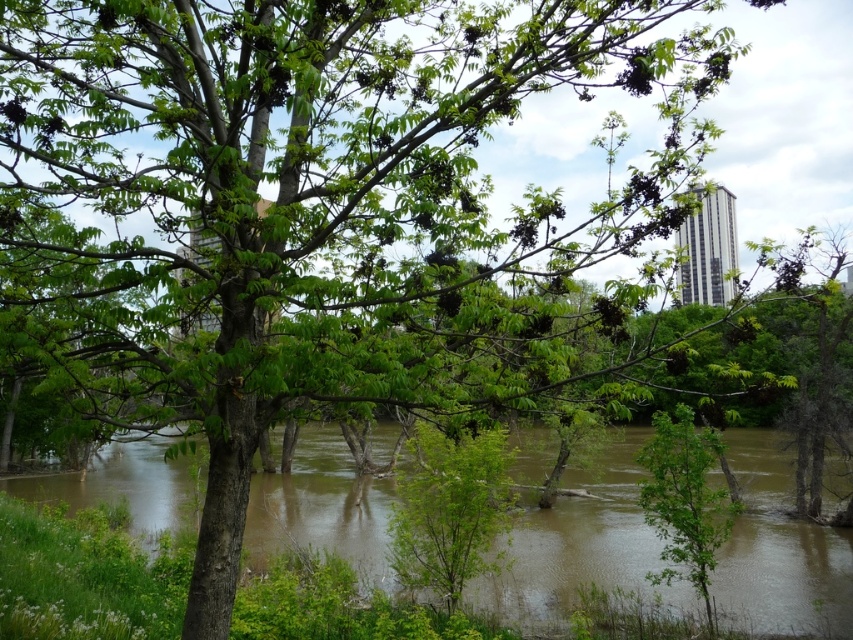
Based on the photo, you are standing in the middle of the flooded area and want to reach the tree in the foreground. Which point, point (328, 547) or point (421, 586), is closer to you?

Point (328, 547) is closer to you because it is further to the viewer than point (421, 586).

You are a hiker trying to cross the flooded area. You see the brown muddy water at lower left and the green leafy tree at center. Which one is bigger in size?

The brown muddy water at lower left has a larger size compared to the green leafy tree at center.